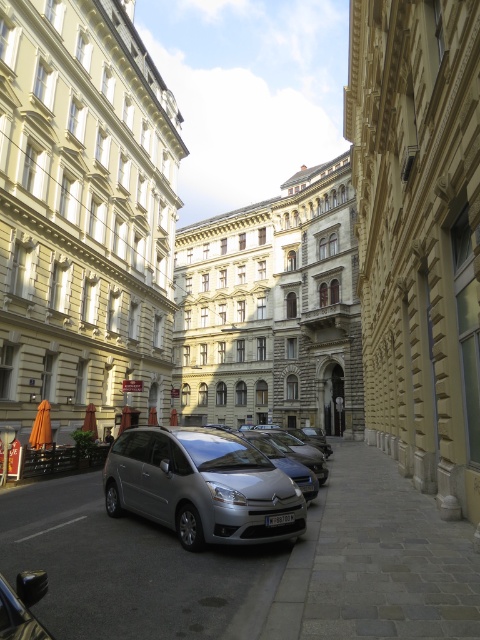
Which is above, gray stone pavement at center or satin metallic car at center?

satin metallic car at center

Does point (415, 515) come behind point (181, 512)?

Yes, point (415, 515) is farther from viewer.

Measure the distance between gray stone pavement at center and camera.

gray stone pavement at center is 52.12 feet away from camera.

Where is `gray stone pavement at center`? gray stone pavement at center is located at coordinates (375, 561).